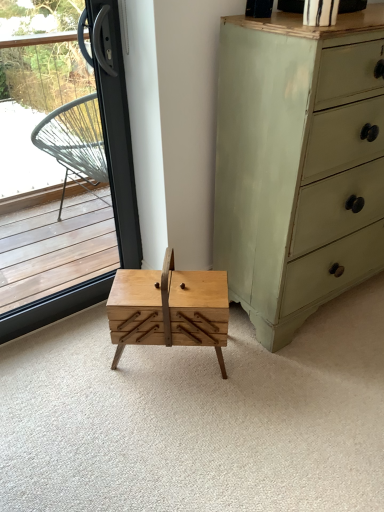
Locate an element on the screen. This screenshot has width=384, height=512. vacant area to the right of natural wood table at center is located at coordinates (261, 367).